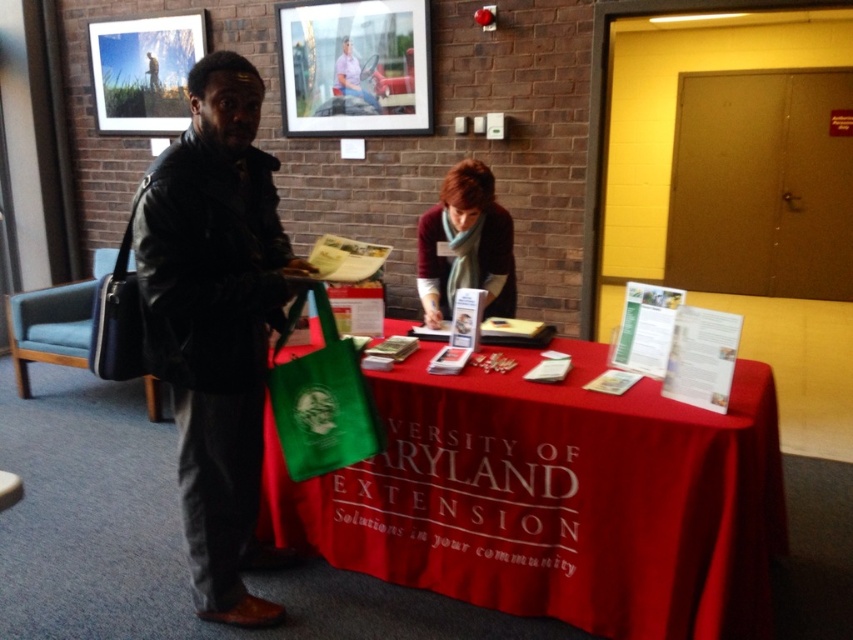
Is red cloth at center above leather jacket at left?

No.

Does red cloth at center have a greater height compared to leather jacket at left?

In fact, red cloth at center may be shorter than leather jacket at left.

You are a GUI agent. You are given a task and a screenshot of the screen. Output one action in this format:
    pyautogui.click(x=<x>, y=<y>)
    Task: Click on the red cloth at center
    
    Given the screenshot: What is the action you would take?
    555,497

Does point (209, 412) lie behind point (341, 348)?

Yes, it is.

Is point (170, 328) farther from viewer compared to point (285, 340)?

That is False.

The height and width of the screenshot is (640, 853). Find the location of `leather jacket at left`. leather jacket at left is located at coordinates (216, 323).

Which is more to the right, green fabric bag at center or maroon sweater at center?

Positioned to the right is maroon sweater at center.

You are a GUI agent. You are given a task and a screenshot of the screen. Output one action in this format:
    pyautogui.click(x=<x>, y=<y>)
    Task: Click on the green fabric bag at center
    This screenshot has width=853, height=640.
    Given the screenshot: What is the action you would take?
    pyautogui.click(x=321, y=397)

Where is `green fabric bag at center`? The height and width of the screenshot is (640, 853). green fabric bag at center is located at coordinates 321,397.